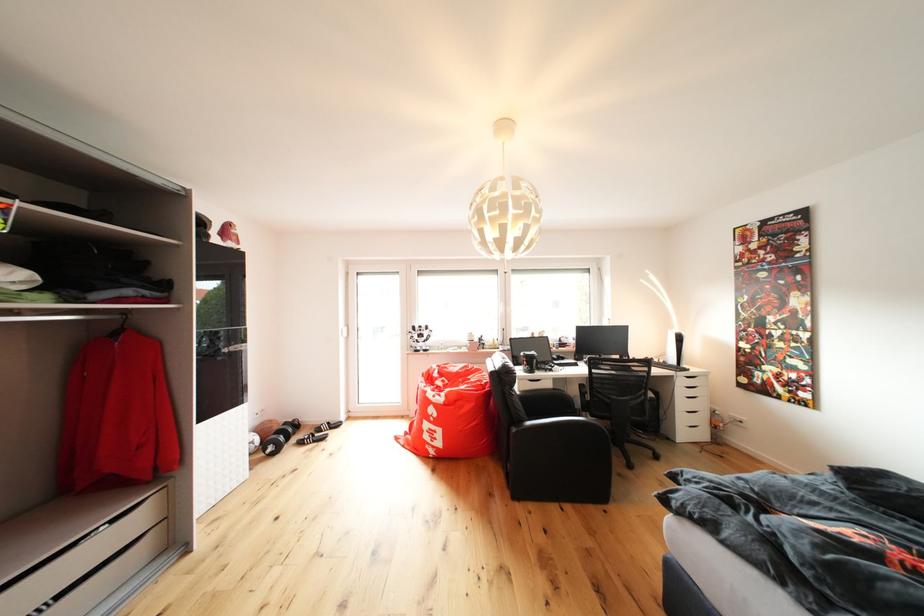
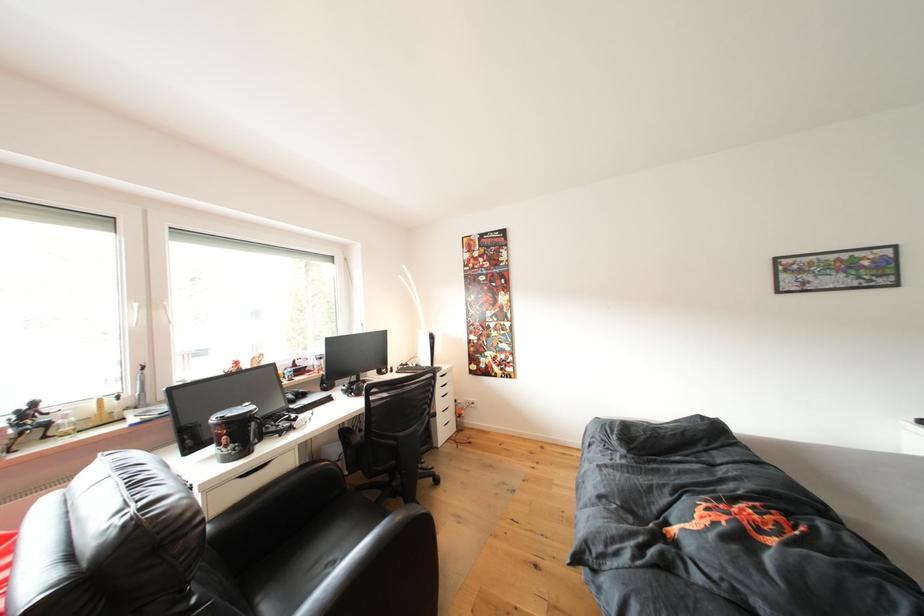
Find the pixel in the second image that matches (x=490, y=344) in the first image.

(35, 419)